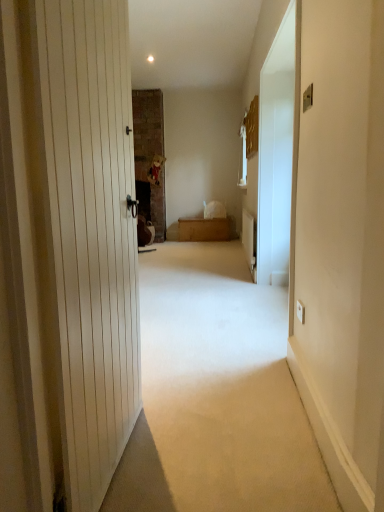
Find the location of a particular element. white glossy screen door at right is located at coordinates (276, 155).

In order to click on white glossy screen door at right in this screenshot , I will do `click(276, 155)`.

Is beige carpet at center touching wooden chest at center?

No, beige carpet at center is not next to wooden chest at center.

In terms of height, does beige carpet at center look taller or shorter compared to wooden chest at center?

Considering their sizes, beige carpet at center has less height than wooden chest at center.

Does beige carpet at center appear on the right side of wooden chest at center?

Incorrect, beige carpet at center is not on the right side of wooden chest at center.

Does point (286, 465) come in front of point (222, 229)?

Yes, point (286, 465) is in front of point (222, 229).

Could you tell me if wooden chest at center is turned towards white glossy screen door at right?

Yes, wooden chest at center is turned towards white glossy screen door at right.

From a real-world perspective, is wooden chest at center physically located above or below white glossy screen door at right?

Clearly, from a real-world perspective, wooden chest at center is below white glossy screen door at right.

Consider the image. Does wooden chest at center come behind white glossy screen door at right?

Yes, wooden chest at center is behind white glossy screen door at right.

From a real-world perspective, is beige carpet at center physically located above or below white glossy screen door at right?

From a real-world perspective, beige carpet at center is physically below white glossy screen door at right.

Are beige carpet at center and white glossy screen door at right making contact?

There is a gap between beige carpet at center and white glossy screen door at right.

The image size is (384, 512). I want to click on screen door behind the beige carpet at center, so click(x=276, y=155).

Is beige carpet at center to the right of white glossy screen door at right from the viewer's perspective?

Incorrect, beige carpet at center is not on the right side of white glossy screen door at right.

Which is more to the left, white glossy screen door at right or beige carpet at center?

beige carpet at center.

Is point (285, 114) closer or farther from the camera than point (248, 502)?

Clearly, point (285, 114) is more distant from the camera than point (248, 502).

From a real-world perspective, which object rests below the other?

beige carpet at center, from a real-world perspective.

Which object is further away from the camera taking this photo, wooden chest at center or beige carpet at center?

wooden chest at center is further away from the camera.

Who is smaller, wooden chest at center or beige carpet at center?

With smaller size is wooden chest at center.

From a real-world perspective, which is physically above, wooden chest at center or beige carpet at center?

wooden chest at center.

Is wooden chest at center wider or thinner than beige carpet at center?

In the image, wooden chest at center appears to be more narrow than beige carpet at center.

Between white glossy screen door at right and wooden chest at center, which one has larger size?

Bigger between the two is wooden chest at center.

Considering the sizes of objects white glossy screen door at right and wooden chest at center in the image provided, who is thinner, white glossy screen door at right or wooden chest at center?

With smaller width is white glossy screen door at right.

From a real-world perspective, which is physically below, white glossy screen door at right or wooden chest at center?

wooden chest at center is physically lower.

Does white glossy screen door at right contain wooden chest at center?

Definitely not — wooden chest at center is not inside white glossy screen door at right.

Find the location of `furniture above the beige carpet at center (from the image's perspective)`. furniture above the beige carpet at center (from the image's perspective) is located at coordinates (205, 229).

At what (x,y) coordinates should I click in order to perform the action: click on furniture that appears on the left of white glossy screen door at right. Please return your answer as a coordinate pair (x, y). This screenshot has height=512, width=384. Looking at the image, I should click on (205, 229).

Looking at this image, looking at the image, which one is located closer to beige carpet at center, wooden chest at center or white glossy screen door at right?

Based on the image, white glossy screen door at right appears to be nearer to beige carpet at center.

When comparing their distances from beige carpet at center, does white glossy screen door at right or wooden chest at center seem closer?

white glossy screen door at right.

Estimate the real-world distances between objects in this image. Which object is closer to wooden chest at center, white glossy screen door at right or beige carpet at center?

Among the two, white glossy screen door at right is located nearer to wooden chest at center.

Which object lies nearer to the anchor point white glossy screen door at right, beige carpet at center or wooden chest at center?

beige carpet at center.

Based on the photo, when comparing their distances from white glossy screen door at right, does wooden chest at center or beige carpet at center seem closer?

beige carpet at center is positioned closer to the anchor white glossy screen door at right.

Which object lies nearer to the anchor point wooden chest at center, beige carpet at center or white glossy screen door at right?

white glossy screen door at right lies closer to wooden chest at center than the other object.

The image size is (384, 512). I want to click on screen door between beige carpet at center and wooden chest at center in the front-back direction, so click(x=276, y=155).